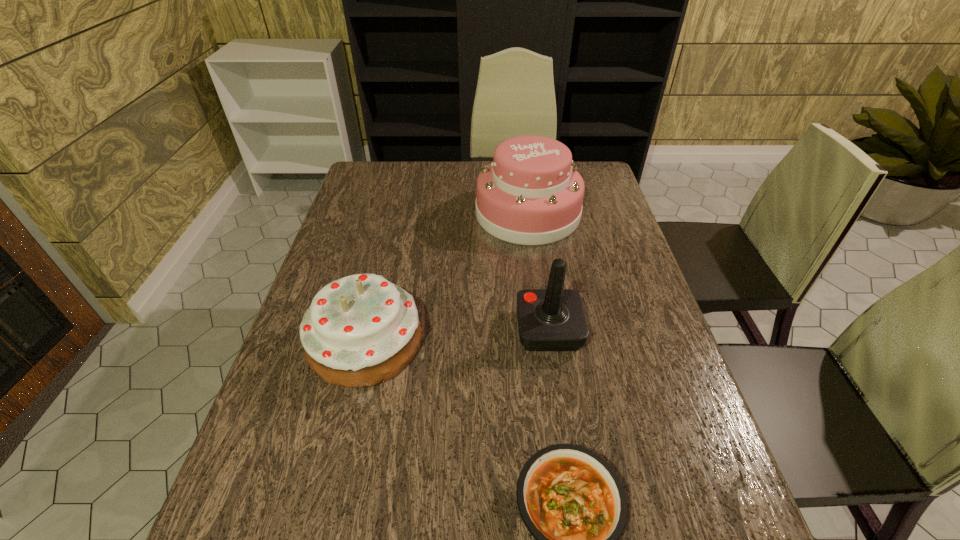
Identify the location of the right cake. (531, 194).

Image resolution: width=960 pixels, height=540 pixels. What are the coordinates of `the farther cake` in the screenshot? It's located at tap(531, 194).

Where is `joystick`? This screenshot has width=960, height=540. joystick is located at coordinates [x=553, y=319].

Locate an element on the screen. the shorter cake is located at coordinates (361, 330).

Find the location of a particular element. The width and height of the screenshot is (960, 540). the second shortest object is located at coordinates pyautogui.click(x=361, y=330).

This screenshot has height=540, width=960. Identify the location of free space located 0.230m on the left of the taller cake. (403, 213).

Where is `free space located 0.370m on the back of the joystick`? The height and width of the screenshot is (540, 960). free space located 0.370m on the back of the joystick is located at coordinates (533, 220).

Locate an element on the screen. This screenshot has width=960, height=540. vacant region located 0.320m on the back of the leftmost object is located at coordinates (394, 226).

The image size is (960, 540). In order to click on object present at the far edge in this screenshot , I will do `click(531, 194)`.

Where is `object that is at the left edge`? This screenshot has height=540, width=960. object that is at the left edge is located at coordinates (361, 330).